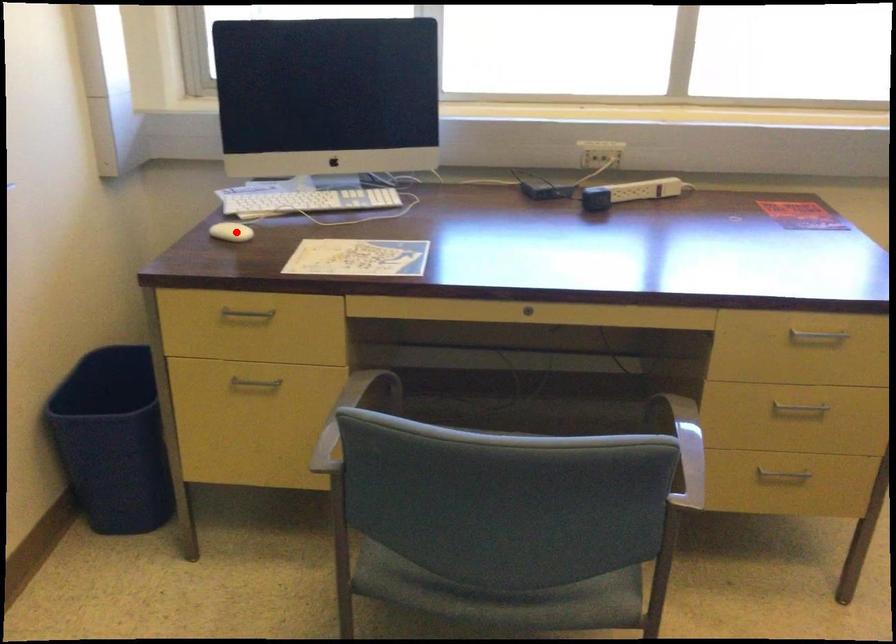
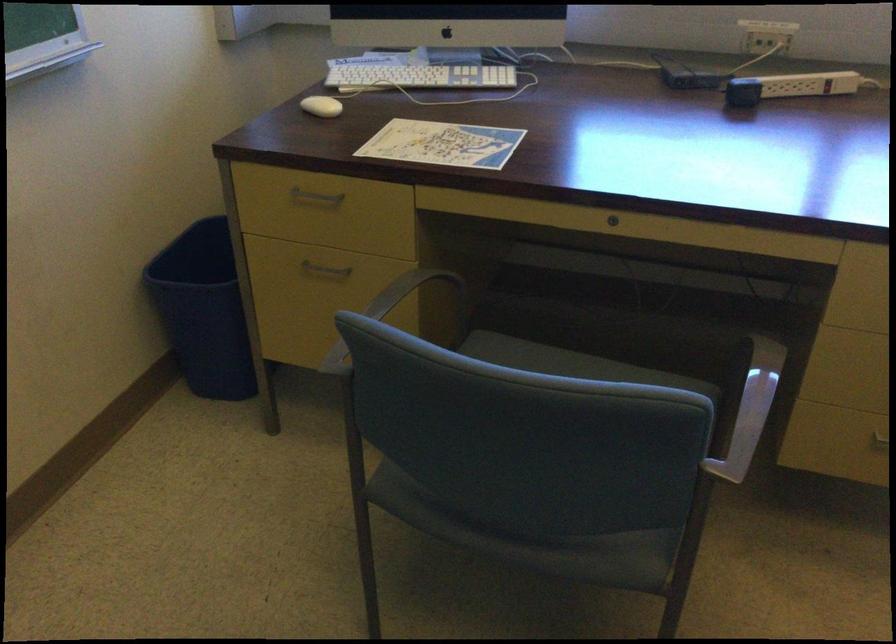
In the second image, find the point that corresponds to the highlighted location in the first image.

(321, 106)